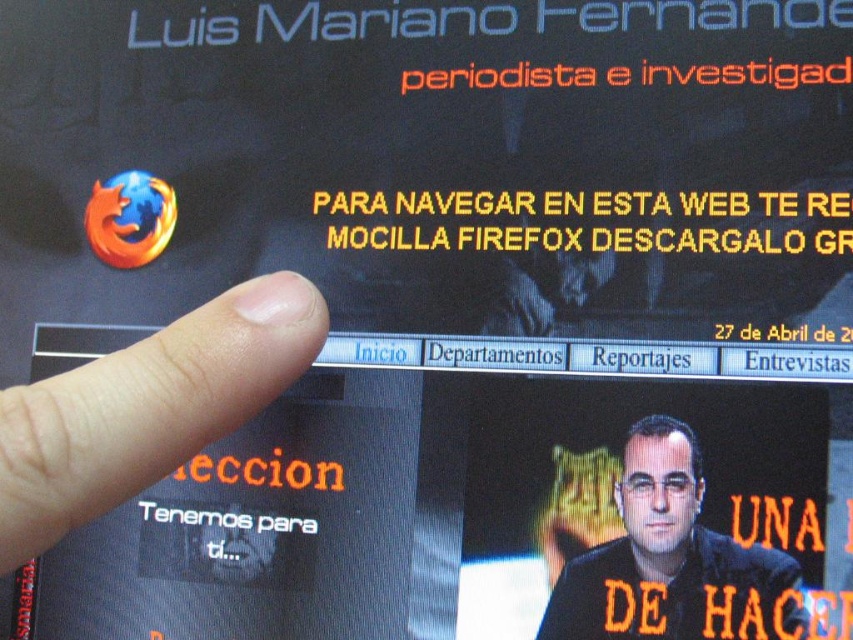
Question: Is flesh-toned skin at lower left further to camera compared to black glossy shirt at lower right?

Choices:
 (A) yes
 (B) no

Answer: (B)

Question: Which of the following is the farthest from the observer?

Choices:
 (A) black glossy shirt at lower right
 (B) flesh-toned skin at lower left

Answer: (A)

Question: Does flesh-toned skin at lower left appear under black glossy shirt at lower right?

Choices:
 (A) yes
 (B) no

Answer: (B)

Question: Which point is farther from the camera taking this photo?

Choices:
 (A) (708, 595)
 (B) (274, 332)

Answer: (A)

Question: Is flesh-toned skin at lower left above black glossy shirt at lower right?

Choices:
 (A) no
 (B) yes

Answer: (B)